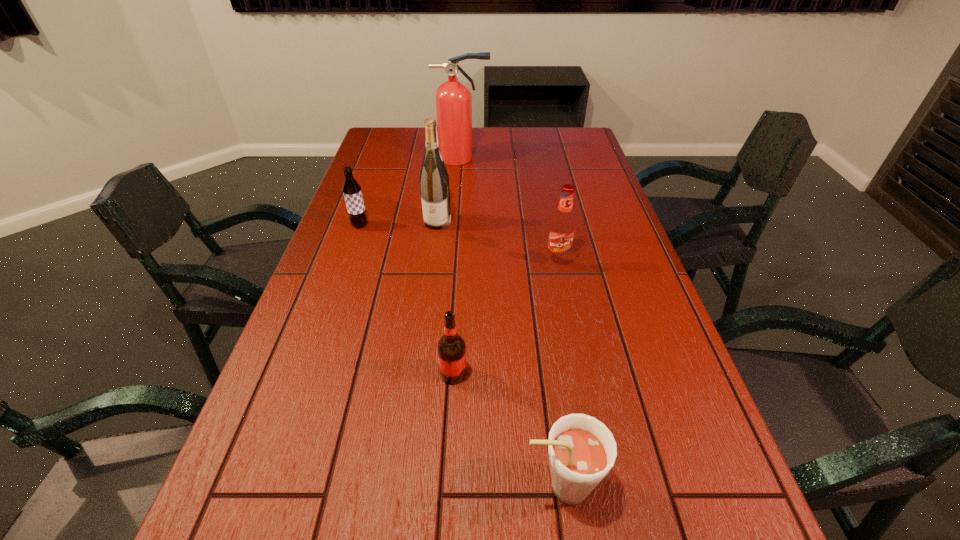
At what (x,y) coordinates should I click in order to perform the action: click on vacant area situated on the back of the wine bottle. Please return your answer as a coordinate pair (x, y). Looking at the image, I should click on (440, 204).

The image size is (960, 540). I want to click on free spot located 0.060m on the front of the third tallest object, so click(563, 283).

The height and width of the screenshot is (540, 960). What are the coordinates of `vacant space located on the front of the farthest root beer` in the screenshot? It's located at (349, 254).

Locate an element on the screen. This screenshot has width=960, height=540. free space located 0.300m on the drink side of the nearest root beer is located at coordinates (348, 485).

Image resolution: width=960 pixels, height=540 pixels. I want to click on free space located on the drink side of the nearest root beer, so click(x=394, y=485).

Locate an element on the screen. vacant position located 0.050m on the drink side of the nearest root beer is located at coordinates (492, 485).

At what (x,y) coordinates should I click in order to perform the action: click on vacant space located 0.140m on the front of the third root beer from right to left. Please return your answer as a coordinate pair (x, y). This screenshot has width=960, height=540. Looking at the image, I should click on (449, 450).

The height and width of the screenshot is (540, 960). Identify the location of object at the far edge. (453, 99).

Locate an element on the screen. The height and width of the screenshot is (540, 960). object that is at the left edge is located at coordinates (351, 189).

I want to click on free spot at the far edge of the desktop, so click(498, 130).